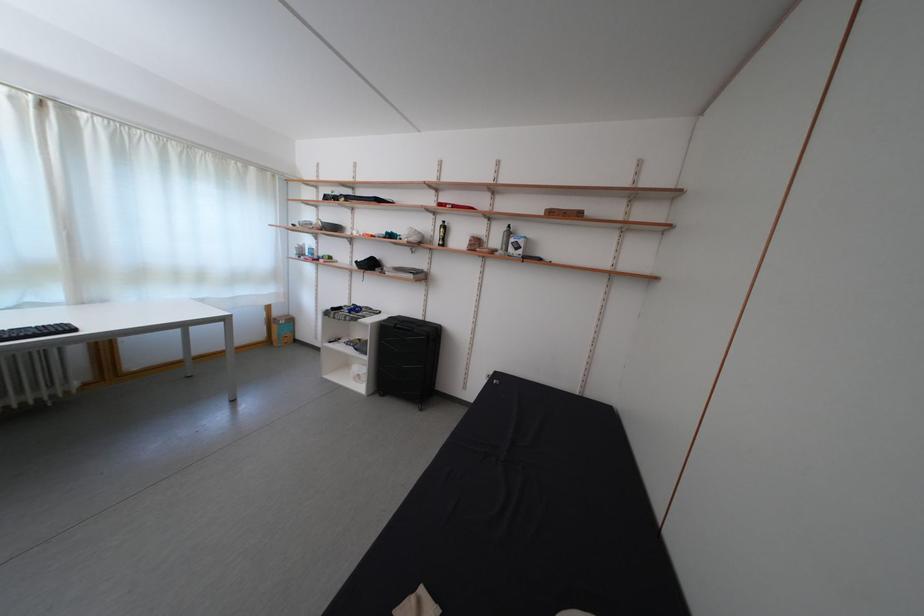
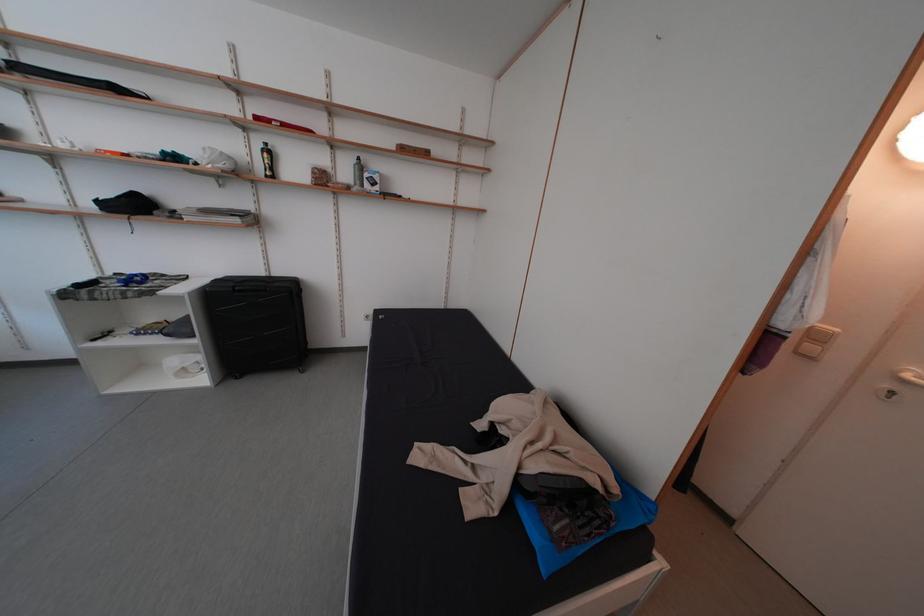
In the second image, find the point that corresponds to point (427, 320) in the first image.

(265, 276)